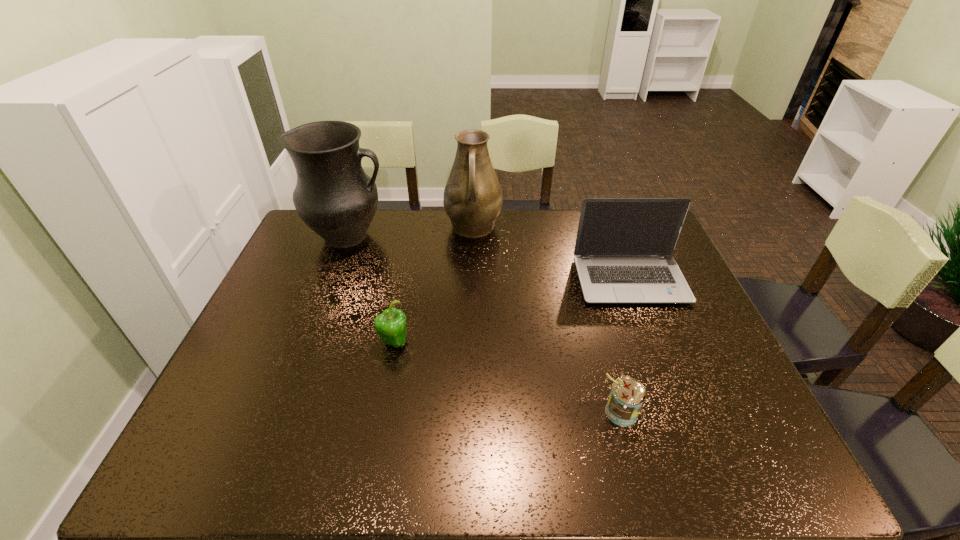
Find the location of a particular element. unoccupied position between the fourth object from right to left and the right pitcher is located at coordinates (434, 285).

You are a GUI agent. You are given a task and a screenshot of the screen. Output one action in this format:
    pyautogui.click(x=<x>, y=<y>)
    Task: Click on the unoccupied position between the second object from left to right and the left pitcher
    The width and height of the screenshot is (960, 540).
    Given the screenshot: What is the action you would take?
    372,289

Identify the location of free spot between the leftmost object and the right pitcher. (411, 232).

You are a GUI agent. You are given a task and a screenshot of the screen. Output one action in this format:
    pyautogui.click(x=<x>, y=<y>)
    Task: Click on the free space between the third object from right to left and the third shortest object
    The image size is (960, 540).
    Given the screenshot: What is the action you would take?
    [x=552, y=254]

Where is `free spot between the left pitcher and the nearest object`? The height and width of the screenshot is (540, 960). free spot between the left pitcher and the nearest object is located at coordinates (485, 324).

The image size is (960, 540). What are the coordinates of `vacant point located between the laptop computer and the leftmost object` in the screenshot? It's located at (490, 259).

I want to click on empty space that is in between the third object from right to left and the nearest object, so click(547, 320).

At what (x,y) coordinates should I click in order to perform the action: click on free space between the right pitcher and the leftmost object. Please return your answer as a coordinate pair (x, y). This screenshot has height=540, width=960. Looking at the image, I should click on (411, 232).

Where is `free space between the right pitcher and the laptop computer`? Image resolution: width=960 pixels, height=540 pixels. free space between the right pitcher and the laptop computer is located at coordinates (552, 254).

What are the coordinates of `free space between the third shortest object and the can` in the screenshot? It's located at (625, 346).